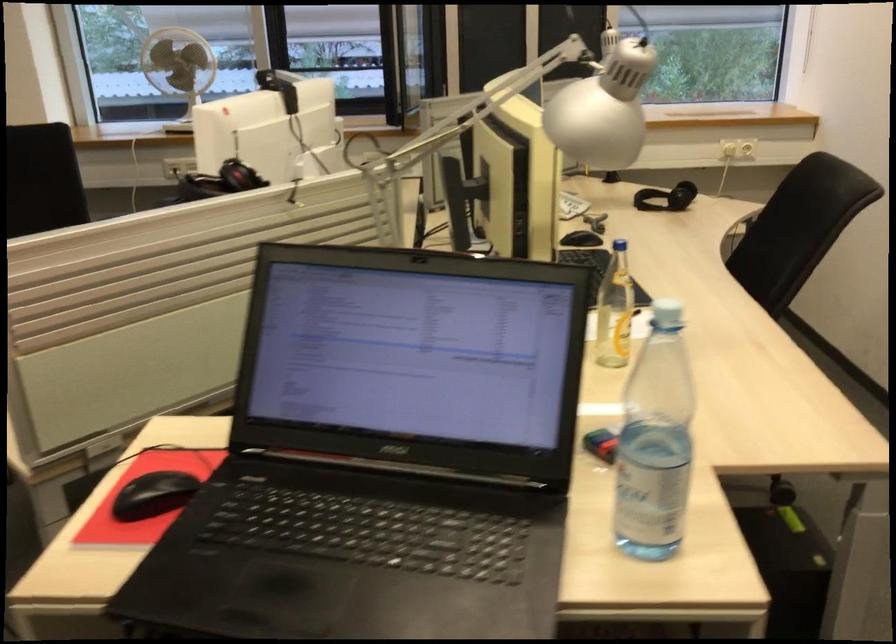
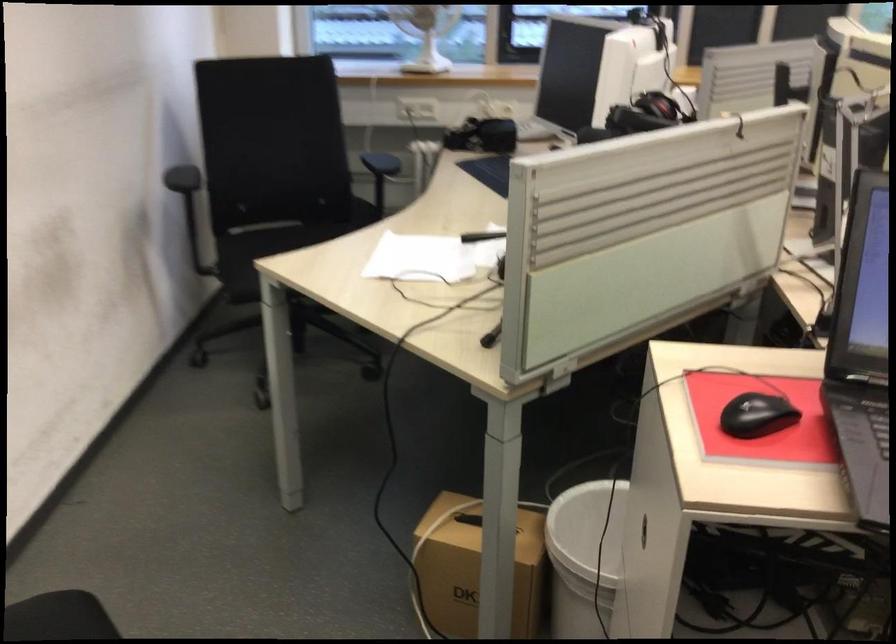
Locate, in the second image, the point that corresponds to point 138,498 in the first image.

(756, 415)